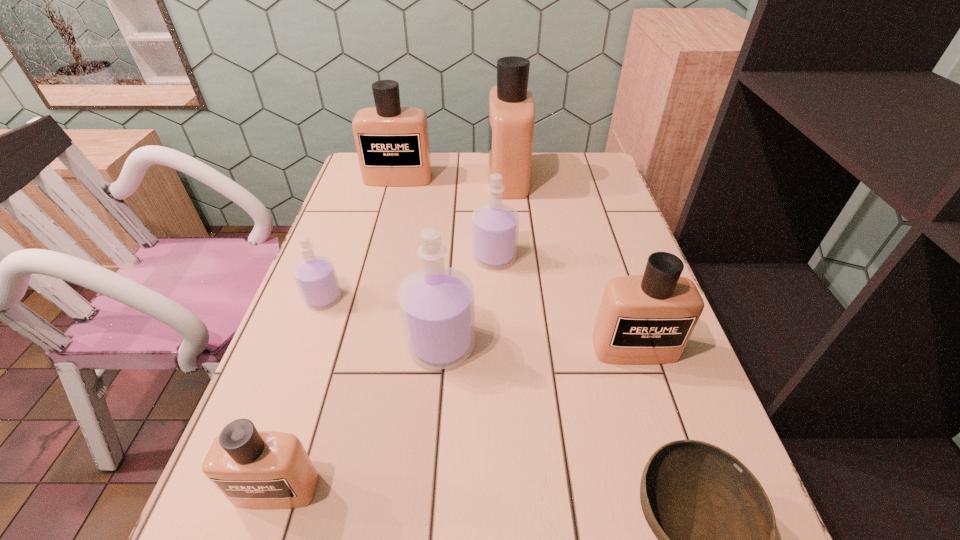
Image resolution: width=960 pixels, height=540 pixels. I want to click on the tallest perfume, so click(511, 121).

Where is `the third beige perfume from left to right`? The width and height of the screenshot is (960, 540). the third beige perfume from left to right is located at coordinates (511, 121).

The width and height of the screenshot is (960, 540). What are the coordinates of `the second biggest beige perfume` in the screenshot? It's located at (392, 142).

Locate an element on the screen. Image resolution: width=960 pixels, height=540 pixels. the biggest purple perfume is located at coordinates pyautogui.click(x=436, y=303).

The image size is (960, 540). I want to click on the fifth nearest perfume, so click(x=494, y=226).

Find the location of a particular element. the second smallest purple perfume is located at coordinates (x=494, y=226).

This screenshot has width=960, height=540. In order to click on the rightmost beige perfume in this screenshot , I will do point(643,319).

Find the location of a particular element. The image size is (960, 540). the second smallest beige perfume is located at coordinates (643, 319).

Identify the location of the fourth nearest perfume. This screenshot has width=960, height=540. (315, 275).

Where is `the second farthest purple perfume`? The height and width of the screenshot is (540, 960). the second farthest purple perfume is located at coordinates (315, 275).